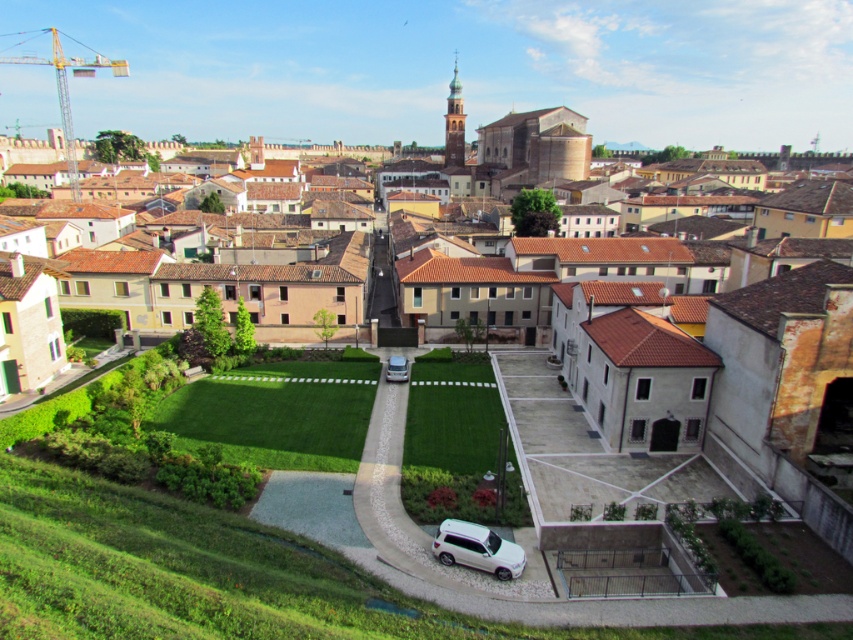
Is white matte car at lower center to the left of silver metallic car at center from the viewer's perspective?

No, white matte car at lower center is not to the left of silver metallic car at center.

Which of these two, white matte car at lower center or silver metallic car at center, stands shorter?

Standing shorter between the two is silver metallic car at center.

Is point (439, 536) positioned before point (393, 376)?

Yes, point (439, 536) is closer to viewer.

Find the location of a particular element. The height and width of the screenshot is (640, 853). white matte car at lower center is located at coordinates (477, 548).